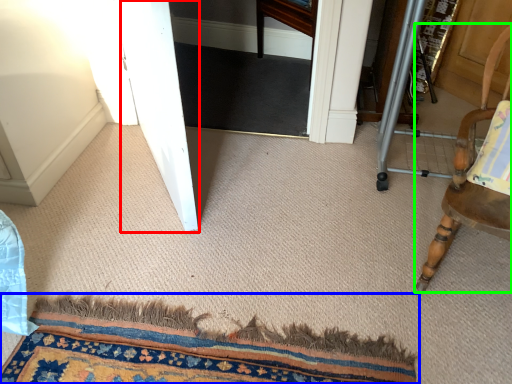
Question: Estimate the real-world distances between objects in this image. Which object is farther from screen door (highlighted by a red box), mat (highlighted by a blue box) or chair (highlighted by a green box)?

Choices:
 (A) mat
 (B) chair

Answer: (B)